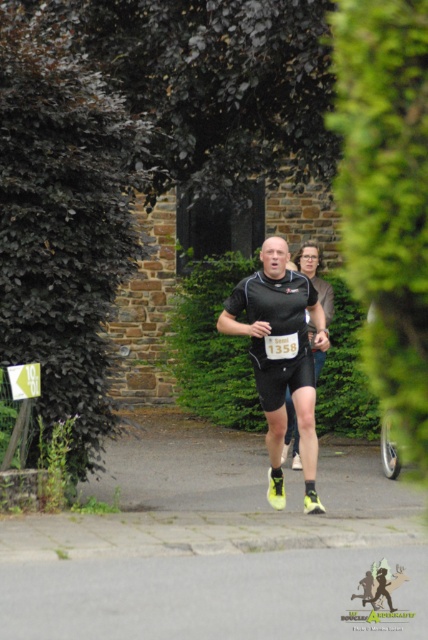
Question: Is dark green leafy hedge at left to the left of green leafy hedge at center from the viewer's perspective?

Choices:
 (A) yes
 (B) no

Answer: (A)

Question: Among these objects, which one is farthest from the camera?

Choices:
 (A) matte black running suit at center
 (B) green leafy hedge at center
 (C) dark green leafy hedge at left

Answer: (B)

Question: Does dark green leafy hedge at left have a greater width compared to matte black running suit at center?

Choices:
 (A) no
 (B) yes

Answer: (B)

Question: Which point is farther from the camera taking this photo?

Choices:
 (A) (275, 435)
 (B) (228, 349)

Answer: (B)

Question: Which point is closer to the camera?

Choices:
 (A) dark green leafy hedge at left
 (B) matte black running suit at center

Answer: (A)

Question: Is dark green leafy hedge at left to the right of green leafy hedge at center from the viewer's perspective?

Choices:
 (A) no
 (B) yes

Answer: (A)